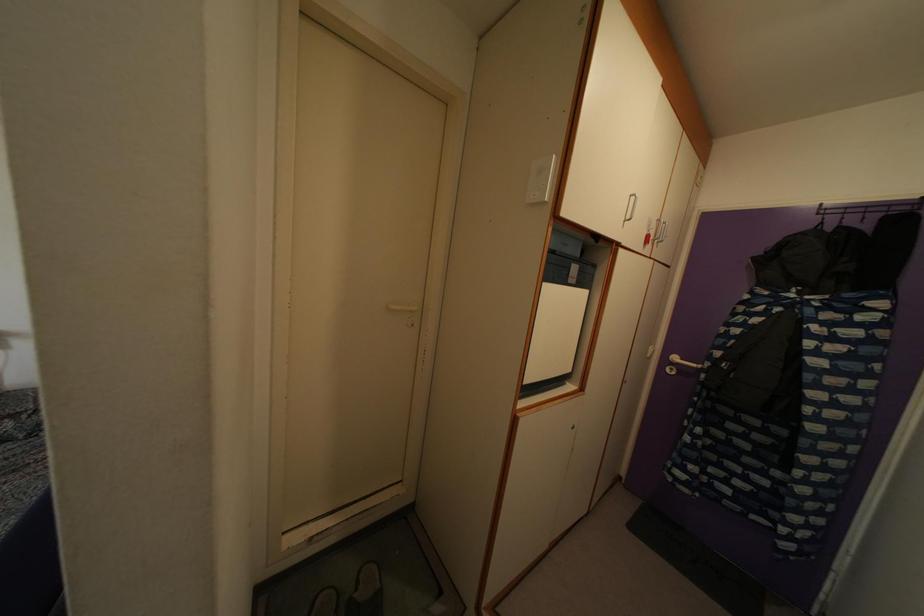
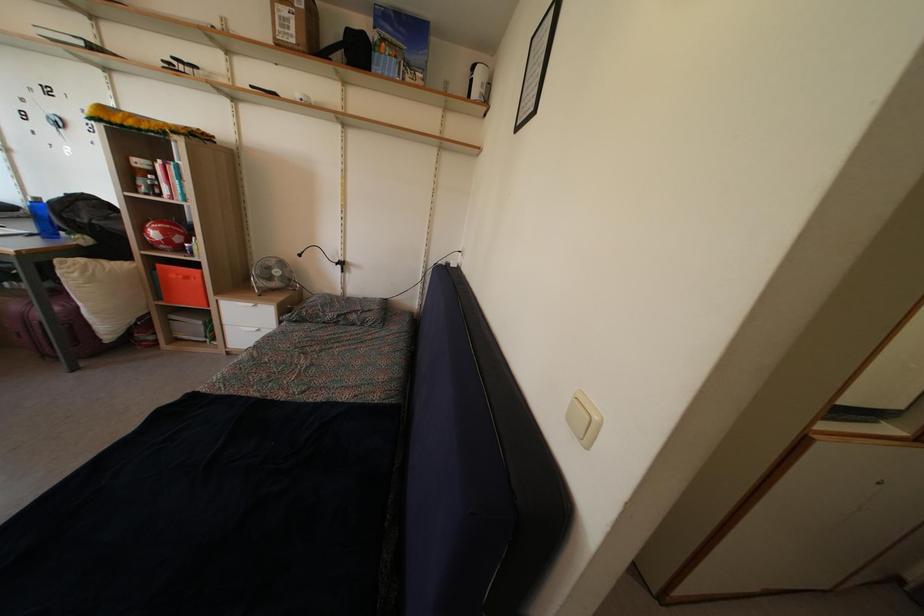
Question: The camera is either moving clockwise (left) or counter-clockwise (right) around the object. The first image is from the beginning of the video and the second image is from the end. Is the camera moving left or right when shooting the video?

Choices:
 (A) Left
 (B) Right

Answer: (B)